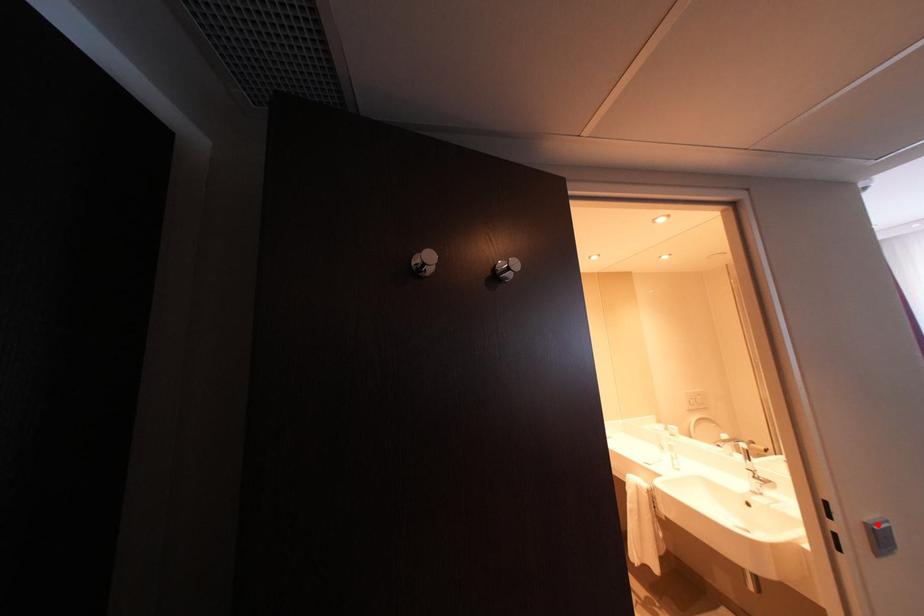
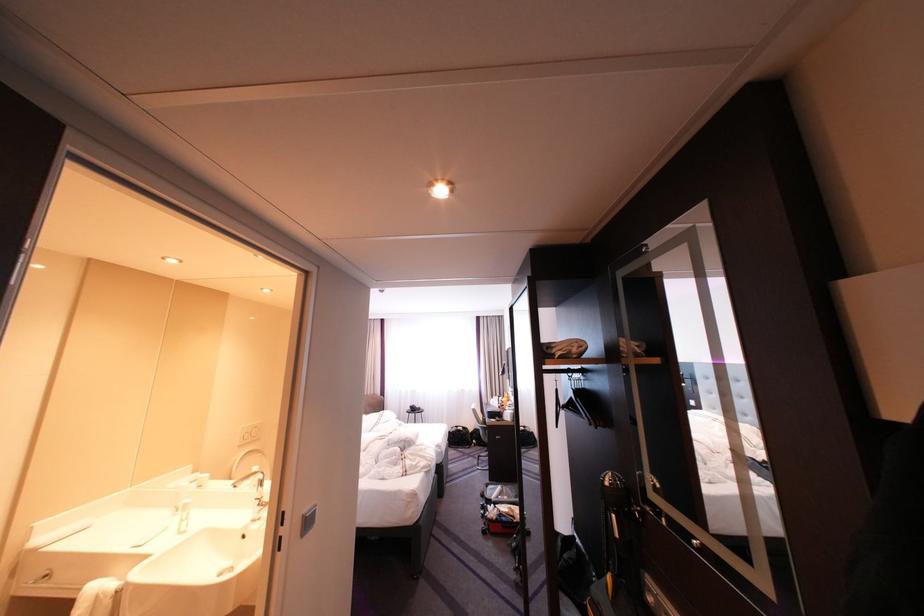
Find the pixel in the second image that matches the highlighted location in the first image.

(314, 516)